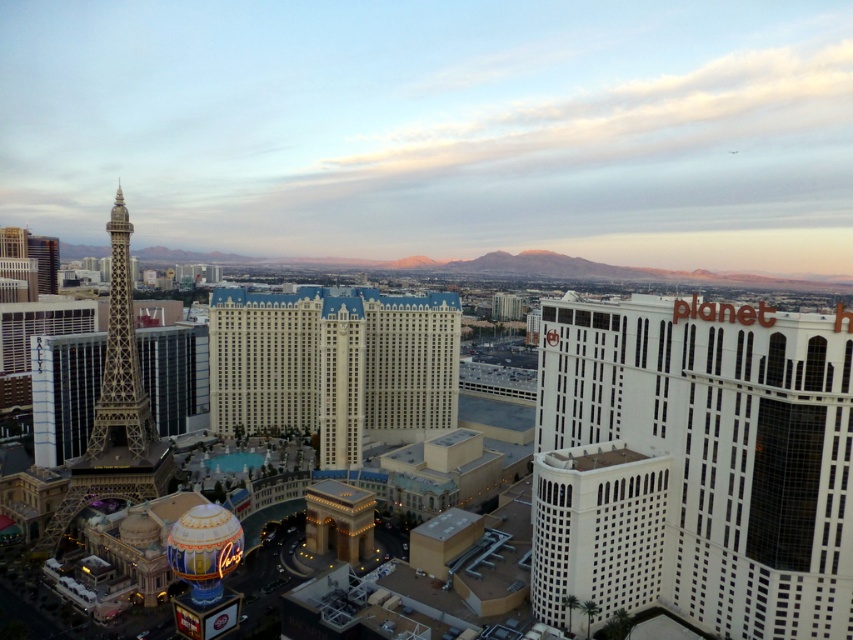
Question: Which of these objects is positioned farthest from the white glass building at right?

Choices:
 (A) matte glass tower at left
 (B) gold metallic eiffel tower at left

Answer: (A)

Question: Which object is the farthest from the white textured building at center?

Choices:
 (A) white glass building at right
 (B) gold metallic eiffel tower at left

Answer: (A)

Question: Does matte glass tower at left appear over white glass building at right?

Choices:
 (A) yes
 (B) no

Answer: (A)

Question: Which point appears closest to the camera in this image?

Choices:
 (A) (112, 490)
 (B) (422, 328)
 (C) (664, 378)

Answer: (C)

Question: Does matte glass tower at left have a lesser width compared to gold metallic eiffel tower at left?

Choices:
 (A) yes
 (B) no

Answer: (B)

Question: Can you confirm if matte glass tower at left is wider than white glass building at right?

Choices:
 (A) no
 (B) yes

Answer: (B)